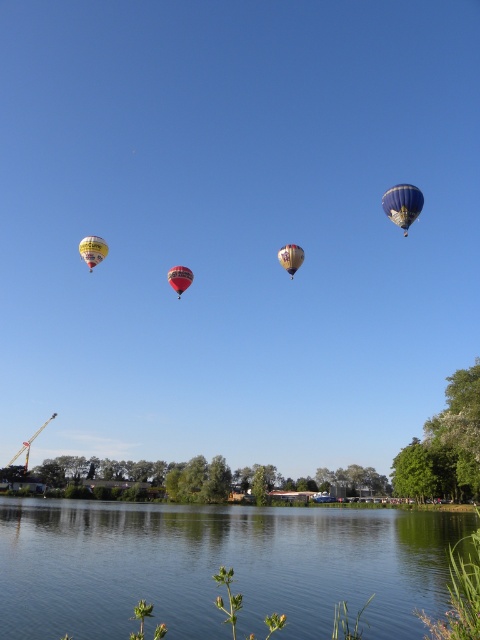
Question: Which point is farther to the camera?

Choices:
 (A) (412, 186)
 (B) (179, 289)

Answer: (B)

Question: Can you confirm if blue glossy hot air balloon at upper right is wider than yellow fabric balloon at upper left?

Choices:
 (A) no
 (B) yes

Answer: (A)

Question: Where is yellow fabric balloon at upper left located in relation to multicolored fabric balloon at center in the image?

Choices:
 (A) left
 (B) right

Answer: (A)

Question: Is the position of blue glossy hot air balloon at upper right less distant than that of multicolored fabric balloon at center?

Choices:
 (A) yes
 (B) no

Answer: (A)

Question: Which object is farther from the camera taking this photo?

Choices:
 (A) multicolored fabric balloon at center
 (B) yellow fabric balloon at upper left

Answer: (B)

Question: Which point is closer to the camera?

Choices:
 (A) yellow fabric balloon at upper left
 (B) blue glossy hot air balloon at upper right
 (C) multicolored fabric balloon at center
 (D) green smooth water at lower center

Answer: (D)